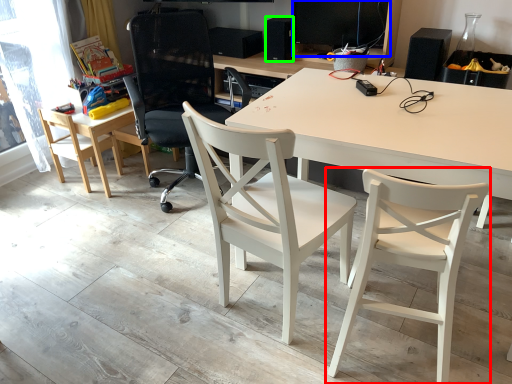
Question: Considering the real-world distances, which object is closest to chair (highlighted by a red box)? computer monitor (highlighted by a blue box) or speaker (highlighted by a green box).

Choices:
 (A) computer monitor
 (B) speaker

Answer: (A)